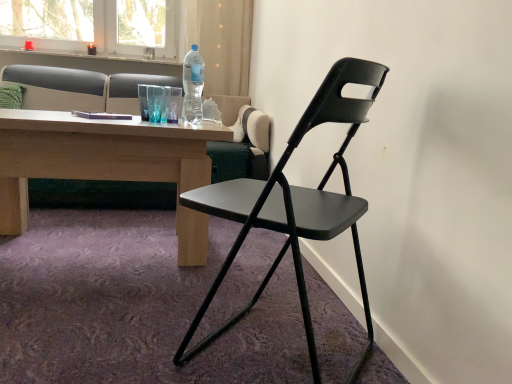
I want to click on matte black folding chair at center, so click(295, 203).

What is the approximate width of matte gray studio couch at upper left?

matte gray studio couch at upper left is 38.39 inches in width.

Identify the location of matte black folding chair at center. The image size is (512, 384). (295, 203).

From the image's perspective, is matte black folding chair at center above matte gray studio couch at upper left?

No.

Is point (180, 352) positioned after point (100, 106)?

No, (180, 352) is in front of (100, 106).

From a real-world perspective, is matte black folding chair at center under matte gray studio couch at upper left?

Indeed, from a real-world perspective, matte black folding chair at center is positioned beneath matte gray studio couch at upper left.

Between matte black folding chair at center and matte gray studio couch at upper left, which one appears on the left side from the viewer's perspective?

matte gray studio couch at upper left is more to the left.

Is matte gray studio couch at upper left positioned beyond the bounds of transparent plastic bottle at upper center?

Absolutely, matte gray studio couch at upper left is external to transparent plastic bottle at upper center.

Between matte gray studio couch at upper left and transparent plastic bottle at upper center, which one has smaller size?

transparent plastic bottle at upper center.

Considering the sizes of matte gray studio couch at upper left and transparent plastic bottle at upper center in the image, is matte gray studio couch at upper left wider or thinner than transparent plastic bottle at upper center?

Considering their sizes, matte gray studio couch at upper left looks broader than transparent plastic bottle at upper center.

Is matte black folding chair at center not within transparent plastic bottle at upper center?

Indeed, matte black folding chair at center is completely outside transparent plastic bottle at upper center.

What's the angular difference between matte black folding chair at center and transparent plastic bottle at upper center's facing directions?

The facing directions of matte black folding chair at center and transparent plastic bottle at upper center are 127 degrees apart.

Can you confirm if matte black folding chair at center is shorter than transparent plastic bottle at upper center?

No, matte black folding chair at center is not shorter than transparent plastic bottle at upper center.

Considering the sizes of objects matte black folding chair at center and transparent plastic bottle at upper center in the image provided, who is thinner, matte black folding chair at center or transparent plastic bottle at upper center?

transparent plastic bottle at upper center.

From a real-world perspective, is green fabric pillow at upper left above or below transparent plastic bottle at upper center?

green fabric pillow at upper left is below transparent plastic bottle at upper center.

Based on the photo, how different are the orientations of green fabric pillow at upper left and transparent plastic bottle at upper center in degrees?

The angular difference between green fabric pillow at upper left and transparent plastic bottle at upper center is 1.16 degrees.

Does green fabric pillow at upper left touch transparent plastic bottle at upper center?

No, green fabric pillow at upper left is not touching transparent plastic bottle at upper center.

Is matte gray studio couch at upper left surrounding matte black folding chair at center?

No, matte black folding chair at center is not a part of matte gray studio couch at upper left.

From a real-world perspective, which object stands above the other?

matte gray studio couch at upper left, from a real-world perspective.

Looking at this image, considering their positions, is matte gray studio couch at upper left located in front of or behind matte black folding chair at center?

matte gray studio couch at upper left is positioned farther from the viewer than matte black folding chair at center.

Is matte gray studio couch at upper left positioned with its back to matte black folding chair at center?

No, matte gray studio couch at upper left is not facing away from matte black folding chair at center.

From the image's perspective, is transparent plastic bottle at upper center located beneath matte black folding chair at center?

No, from the image's perspective, transparent plastic bottle at upper center is not beneath matte black folding chair at center.

Is transparent plastic bottle at upper center in front of or behind matte black folding chair at center in the image?

In the image, transparent plastic bottle at upper center appears behind matte black folding chair at center.

Looking at this image, how many degrees apart are the facing directions of transparent plastic bottle at upper center and matte black folding chair at center?

The facing directions of transparent plastic bottle at upper center and matte black folding chair at center are 127 degrees apart.

Between transparent plastic bottle at upper center and matte black folding chair at center, which one has larger size?

With larger size is matte black folding chair at center.

Does green fabric pillow at upper left appear on the right side of matte gray studio couch at upper left?

In fact, green fabric pillow at upper left is to the left of matte gray studio couch at upper left.

Can you tell me how much green fabric pillow at upper left and matte gray studio couch at upper left differ in facing direction?

The angular difference between green fabric pillow at upper left and matte gray studio couch at upper left is 0.000229 degrees.

Is green fabric pillow at upper left aimed at matte gray studio couch at upper left?

Yes, green fabric pillow at upper left is turned towards matte gray studio couch at upper left.

Find the location of a particular element. chair beneath the matte gray studio couch at upper left (from a real-world perspective) is located at coordinates (295, 203).

Where is `studio couch on the left side of transparent plastic bottle at upper center`? This screenshot has height=384, width=512. studio couch on the left side of transparent plastic bottle at upper center is located at coordinates (81, 88).

Based on their spatial positions, is green fabric pillow at upper left or transparent plastic bottle at upper center further from matte gray studio couch at upper left?

transparent plastic bottle at upper center is positioned further to the anchor matte gray studio couch at upper left.

When comparing their distances from matte black folding chair at center, does green fabric pillow at upper left or transparent plastic bottle at upper center seem further?

green fabric pillow at upper left lies further to matte black folding chair at center than the other object.

Estimate the real-world distances between objects in this image. Which object is further from green fabric pillow at upper left, matte gray studio couch at upper left or transparent plastic bottle at upper center?

transparent plastic bottle at upper center lies further to green fabric pillow at upper left than the other object.

Based on the photo, considering their positions, is matte black folding chair at center positioned closer to transparent plastic bottle at upper center than matte gray studio couch at upper left?

Based on the image, matte black folding chair at center appears to be nearer to transparent plastic bottle at upper center.

When comparing their distances from green fabric pillow at upper left, does transparent plastic bottle at upper center or matte black folding chair at center seem further?

matte black folding chair at center lies further to green fabric pillow at upper left than the other object.

Looking at the image, which one is located closer to matte black folding chair at center, transparent plastic bottle at upper center or matte gray studio couch at upper left?

Based on the image, transparent plastic bottle at upper center appears to be nearer to matte black folding chair at center.

When comparing their distances from matte gray studio couch at upper left, does transparent plastic bottle at upper center or matte black folding chair at center seem further?

matte black folding chair at center.

Looking at the image, which one is located further to transparent plastic bottle at upper center, matte gray studio couch at upper left or green fabric pillow at upper left?

Based on the image, green fabric pillow at upper left appears to be further to transparent plastic bottle at upper center.

Find the location of `bottle located between matte black folding chair at center and green fabric pillow at upper left in the depth direction`. bottle located between matte black folding chair at center and green fabric pillow at upper left in the depth direction is located at coordinates (193, 86).

Identify the location of studio couch between matte black folding chair at center and green fabric pillow at upper left from front to back. The width and height of the screenshot is (512, 384). (81, 88).

Locate an element on the screen. bottle positioned between matte black folding chair at center and matte gray studio couch at upper left from near to far is located at coordinates (193, 86).

Where is `studio couch situated between green fabric pillow at upper left and transparent plastic bottle at upper center from left to right`? Image resolution: width=512 pixels, height=384 pixels. studio couch situated between green fabric pillow at upper left and transparent plastic bottle at upper center from left to right is located at coordinates [x=81, y=88].